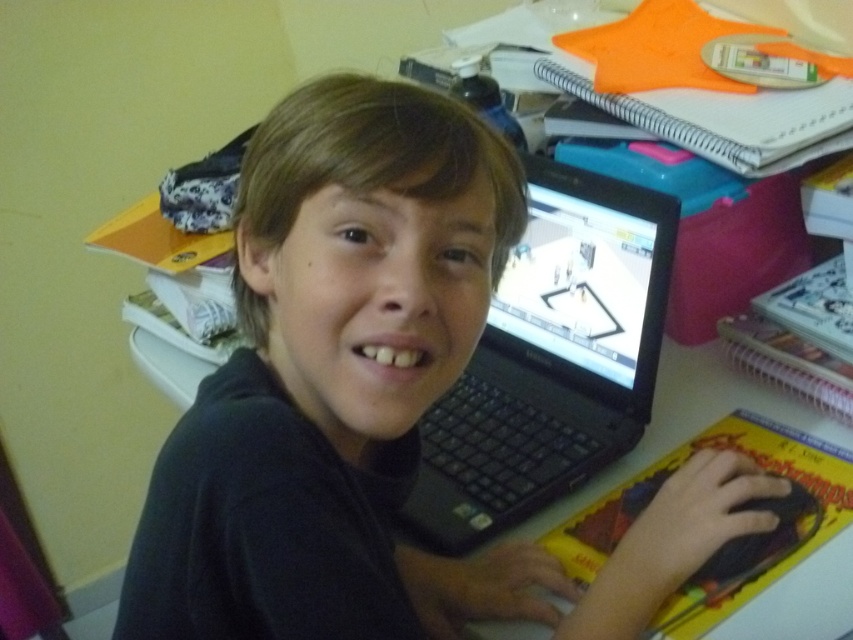
Question: Which of the following is the farthest from the observer?

Choices:
 (A) (635, 625)
 (B) (648, 339)

Answer: (B)

Question: Which object appears closest to the camera in this image?

Choices:
 (A) black matte laptop at center
 (B) black plastic laptop at center

Answer: (A)

Question: Does black matte laptop at center appear on the right side of black plastic laptop at center?

Choices:
 (A) yes
 (B) no

Answer: (B)

Question: Does black matte laptop at center appear on the left side of black plastic laptop at center?

Choices:
 (A) no
 (B) yes

Answer: (B)

Question: Considering the relative positions of black matte laptop at center and black plastic laptop at center in the image provided, where is black matte laptop at center located with respect to black plastic laptop at center?

Choices:
 (A) below
 (B) above

Answer: (A)